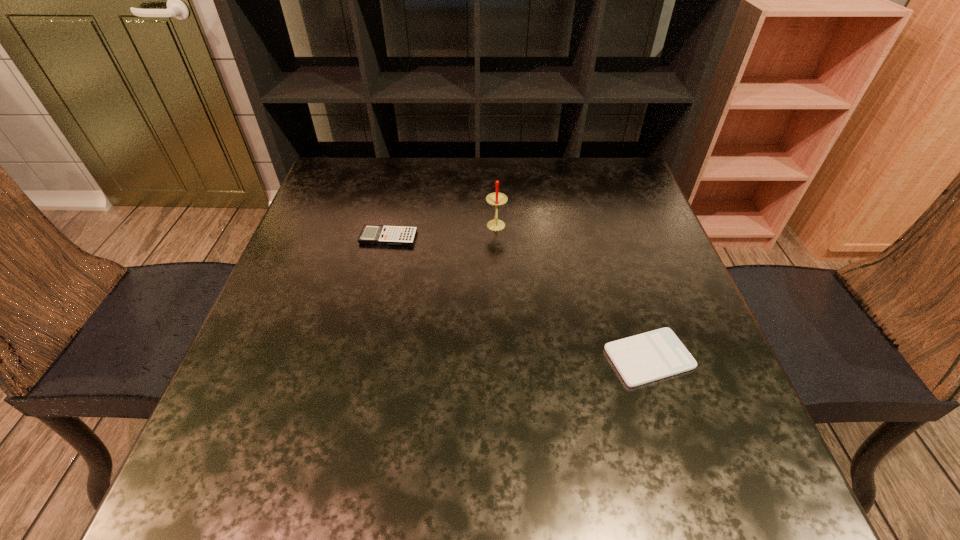
The image size is (960, 540). In order to click on vacant point located between the tallest object and the left calculator in this screenshot , I will do `click(443, 232)`.

The image size is (960, 540). What are the coordinates of `empty space between the candle and the farther calculator` in the screenshot? It's located at (443, 232).

Locate an element on the screen. The width and height of the screenshot is (960, 540). free space between the rightmost object and the candle is located at coordinates (572, 292).

Image resolution: width=960 pixels, height=540 pixels. Identify the location of free spot between the rightmost object and the farther calculator. (518, 298).

Image resolution: width=960 pixels, height=540 pixels. What are the coordinates of `free space between the candle and the farther calculator` in the screenshot? It's located at (443, 232).

What are the coordinates of `vacant region between the farther calculator and the tallest object` in the screenshot? It's located at (443, 232).

Where is `free area in between the farther calculator and the rightmost object`? free area in between the farther calculator and the rightmost object is located at coordinates click(x=518, y=298).

The height and width of the screenshot is (540, 960). What are the coordinates of `free space between the tallest object and the farther calculator` in the screenshot? It's located at (443, 232).

Where is `object that is the closest to the tallest object`? This screenshot has width=960, height=540. object that is the closest to the tallest object is located at coordinates (371, 234).

Where is `the closest object relative to the candle`? Image resolution: width=960 pixels, height=540 pixels. the closest object relative to the candle is located at coordinates (371, 234).